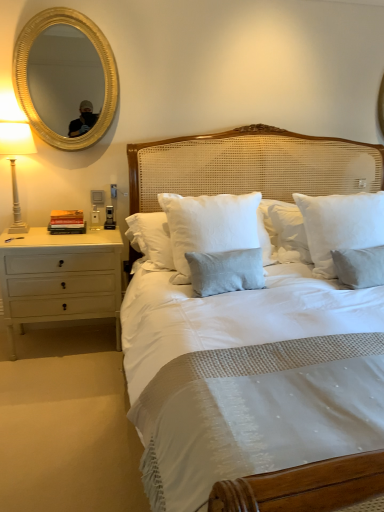
Question: From the image's perspective, does white wood nightstand at left appear higher than gold metallic mirror at upper left?

Choices:
 (A) yes
 (B) no

Answer: (B)

Question: Does white wood nightstand at left turn towards gold metallic mirror at upper left?

Choices:
 (A) yes
 (B) no

Answer: (B)

Question: Is white wood nightstand at left shorter than gold metallic mirror at upper left?

Choices:
 (A) yes
 (B) no

Answer: (A)

Question: Is white wood nightstand at left at the left side of gold metallic mirror at upper left?

Choices:
 (A) no
 (B) yes

Answer: (B)

Question: From the image's perspective, is white wood nightstand at left below gold metallic mirror at upper left?

Choices:
 (A) yes
 (B) no

Answer: (A)

Question: In terms of height, does white cotton pillow at center, marked as the 1th pillow in a left-to-right arrangement, look taller or shorter compared to white cotton pillow at center, marked as the 1th pillow in a right-to-left arrangement?

Choices:
 (A) short
 (B) tall

Answer: (A)

Question: In the image, is white cotton pillow at center, marked as the 1th pillow in a left-to-right arrangement, on the left side or the right side of white cotton pillow at center, the 2th pillow viewed from the left?

Choices:
 (A) left
 (B) right

Answer: (A)

Question: Based on their sizes in the image, would you say white cotton pillow at center, marked as the 1th pillow in a left-to-right arrangement, is bigger or smaller than white cotton pillow at center, the 2th pillow viewed from the left?

Choices:
 (A) small
 (B) big

Answer: (B)

Question: Is white cotton pillow at center, the second pillow from the right, in front of or behind white cotton pillow at center, the 2th pillow viewed from the left, in the image?

Choices:
 (A) front
 (B) behind

Answer: (B)

Question: Based on their positions, is white wood nightstand at left located to the left or right of white cotton pillow at center, the 2th pillow viewed from the left?

Choices:
 (A) right
 (B) left

Answer: (B)

Question: From a real-world perspective, is white wood nightstand at left positioned above or below white cotton pillow at center, the 2th pillow viewed from the left?

Choices:
 (A) above
 (B) below

Answer: (B)

Question: Considering the positions of white wood nightstand at left and white cotton pillow at center, marked as the 1th pillow in a right-to-left arrangement, in the image, is white wood nightstand at left taller or shorter than white cotton pillow at center, marked as the 1th pillow in a right-to-left arrangement,?

Choices:
 (A) tall
 (B) short

Answer: (A)

Question: In the image, is white wood nightstand at left positioned in front of or behind white cotton pillow at center, the 2th pillow viewed from the left?

Choices:
 (A) behind
 (B) front

Answer: (A)

Question: From the image's perspective, is gold metallic mirror at upper left located above or below white ceramic lamp at left?

Choices:
 (A) below
 (B) above

Answer: (B)

Question: Would you say gold metallic mirror at upper left is inside or outside white ceramic lamp at left?

Choices:
 (A) outside
 (B) inside

Answer: (A)